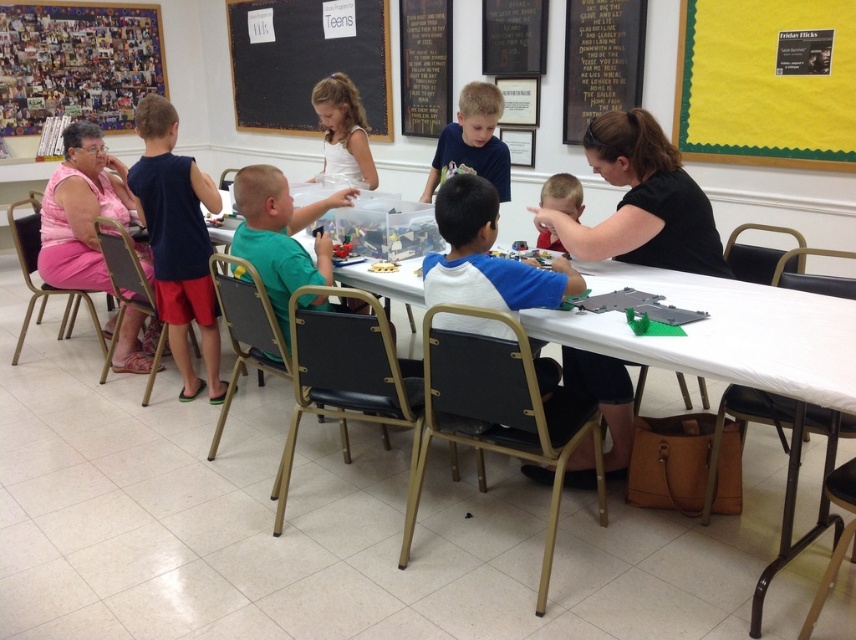
You are sitting at the table and want to hand a tool to the person wearing the blue matte shirt at center. Which direction should you move to reach them from the green fabric chair at center?

The green fabric chair at center is to the left of the blue matte shirt at center, so you should move to your right to reach them.

Consider the image. You are attending a workshop in the classroom and notice the white plastic table at center and the pink fabric dress at left. Which object is taller?

The pink fabric dress at left is taller than the white plastic table at center.

You are standing at the entrance of the room facing the white chalkboard at upper center. If you turn 90 degrees to your right, will you be facing the table or the wall?

The white chalkboard at upper center is located at point (306, 60), so turning 90 degrees to your right from facing it would face you towards the wall, not the table.